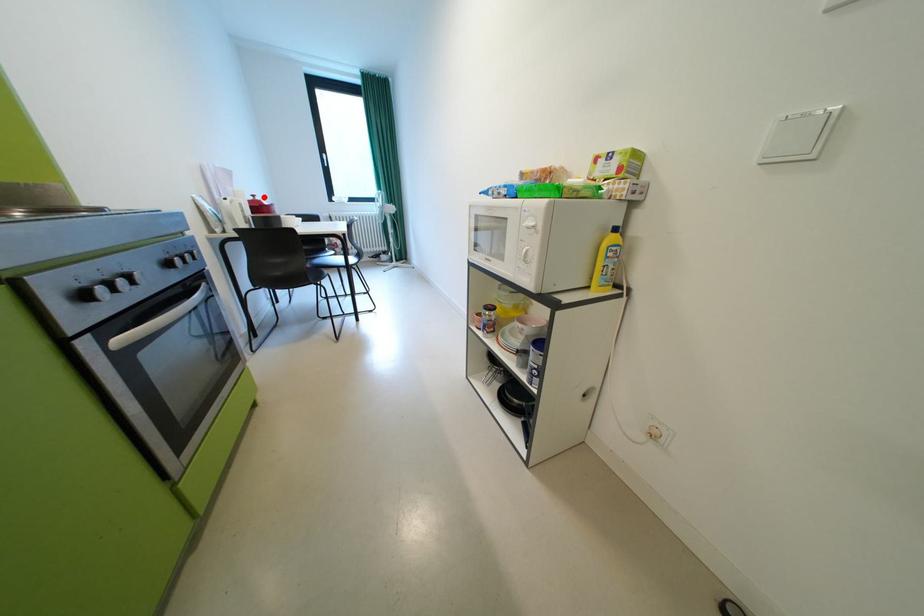
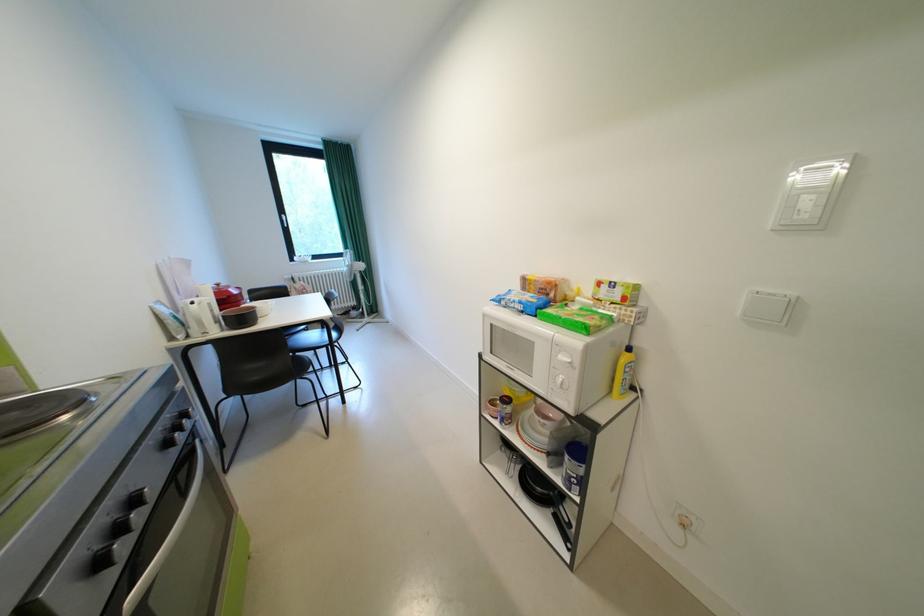
Where in the second image is the point corresponding to the highlighted location from the first image?

(228, 286)